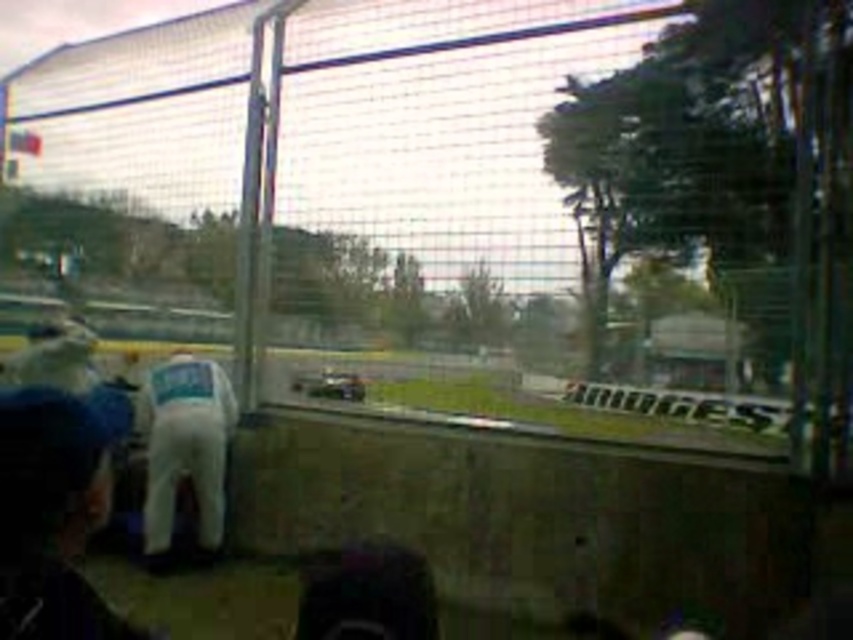
Question: Can you confirm if metallic mesh fence at center is thinner than white fabric man at lower left?

Choices:
 (A) yes
 (B) no

Answer: (B)

Question: Which point is farther to the camera?

Choices:
 (A) white fabric man at lower left
 (B) metallic mesh fence at center

Answer: (A)

Question: Does metallic mesh fence at center have a lesser width compared to white fabric man at lower left?

Choices:
 (A) no
 (B) yes

Answer: (A)

Question: Is metallic mesh fence at center in front of white fabric man at lower left?

Choices:
 (A) yes
 (B) no

Answer: (A)

Question: Which point appears farthest from the camera in this image?

Choices:
 (A) (167, 442)
 (B) (654, 364)

Answer: (B)